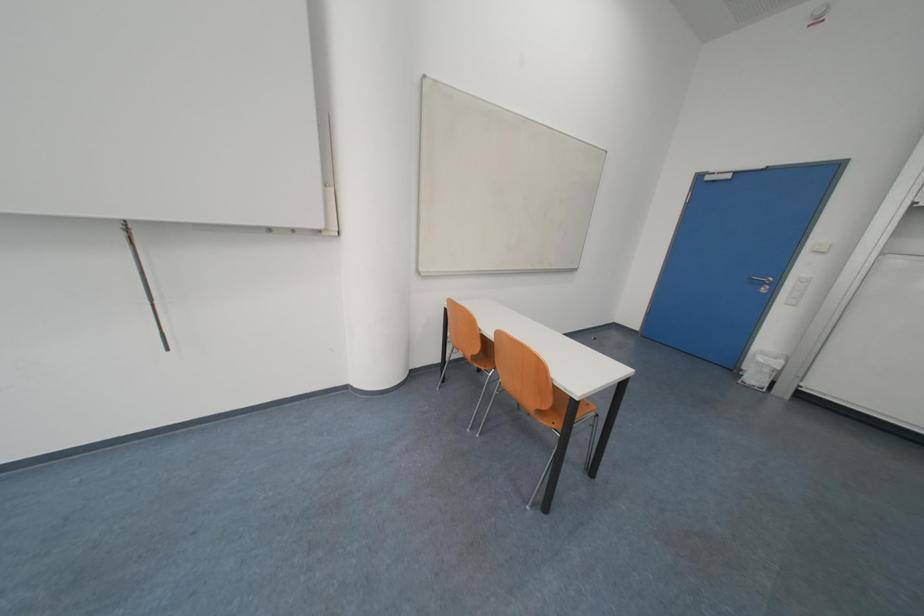
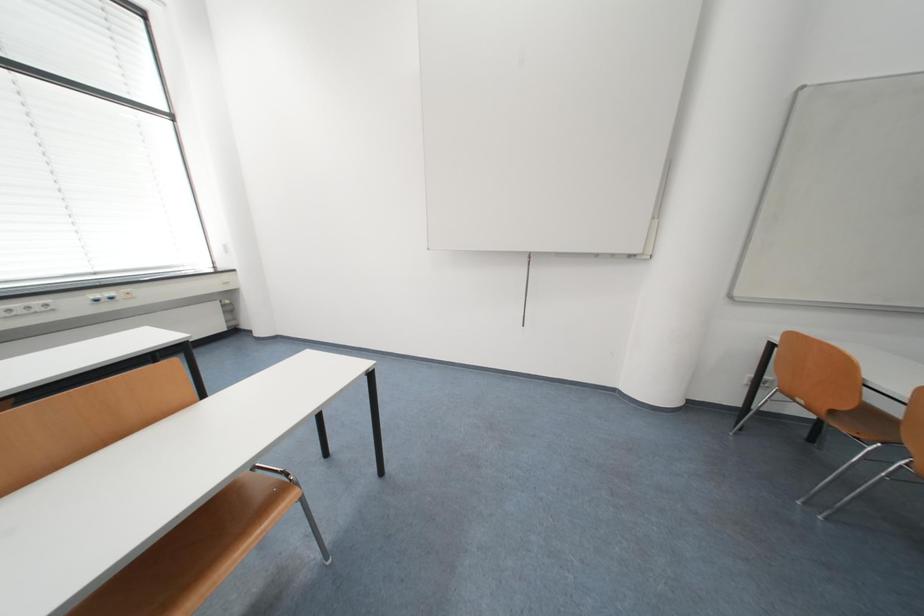
Question: Based on the continuous images, in which direction is the camera rotating? Reply with the corresponding letter.

Choices:
 (A) Left
 (B) Right
 (C) Up
 (D) Down

Answer: (A)